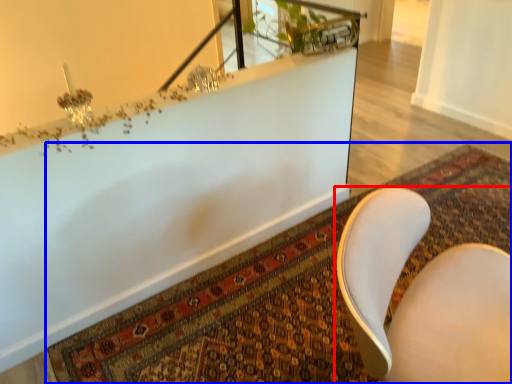
Question: Which point is closer to the camera, chair (highlighted by a red box) or mat (highlighted by a blue box)?

Choices:
 (A) chair
 (B) mat

Answer: (A)